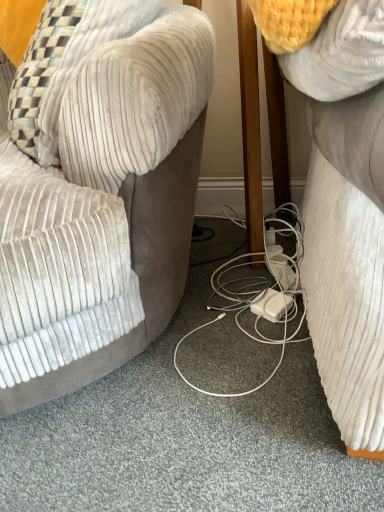
The height and width of the screenshot is (512, 384). What do you see at coordinates (102, 211) in the screenshot?
I see `velvet corduroy chair at left` at bounding box center [102, 211].

Where is `velvet corduroy chair at left`? velvet corduroy chair at left is located at coordinates (102, 211).

This screenshot has height=512, width=384. Identify the location of velvet corduroy chair at left. (102, 211).